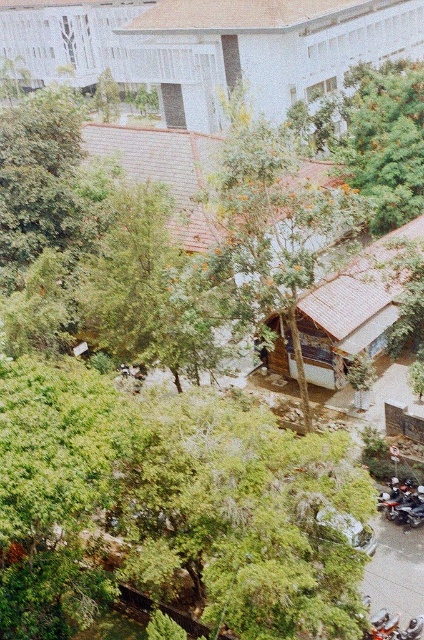
Question: Among these objects, which one is nearest to the camera?

Choices:
 (A) green leafy tree at upper right
 (B) brown wooden hut at upper center
 (C) shiny black motorcycle at lower right
 (D) white wood hut at center

Answer: (D)

Question: Does green leafy tree at upper right appear under white wood hut at center?

Choices:
 (A) yes
 (B) no

Answer: (B)

Question: Estimate the real-world distances between objects in this image. Which object is closer to the brown wooden hut at upper center?

Choices:
 (A) white wood hut at center
 (B) shiny black motorcycle at lower right
 (C) green leafy tree at upper right

Answer: (C)

Question: Which point is farther to the camera?

Choices:
 (A) brown wooden hut at upper center
 (B) green leafy tree at upper right

Answer: (A)

Question: Can you confirm if brown wooden hut at upper center is positioned to the right of green leafy tree at upper right?

Choices:
 (A) no
 (B) yes

Answer: (A)

Question: Can you confirm if brown wooden hut at upper center is thinner than green leafy tree at upper right?

Choices:
 (A) no
 (B) yes

Answer: (A)